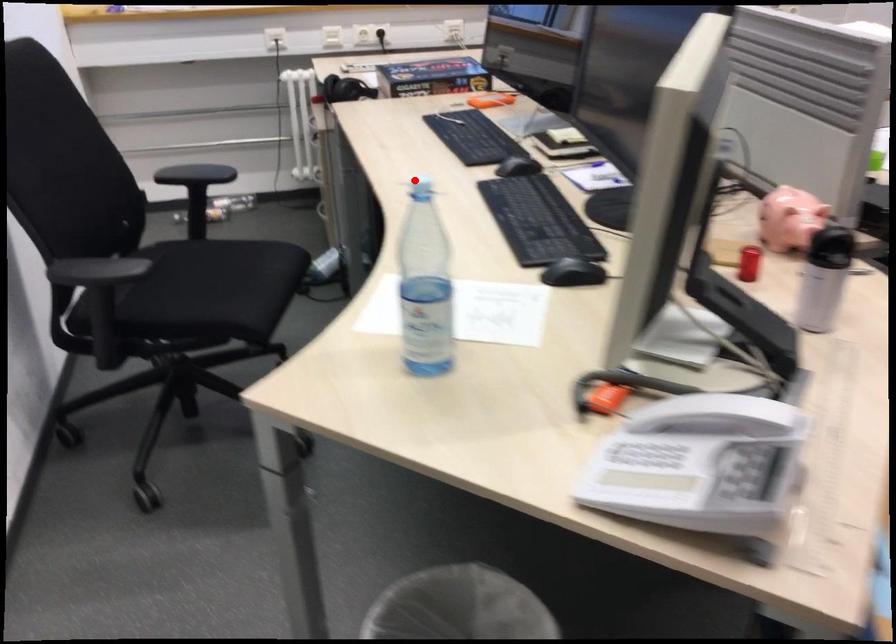
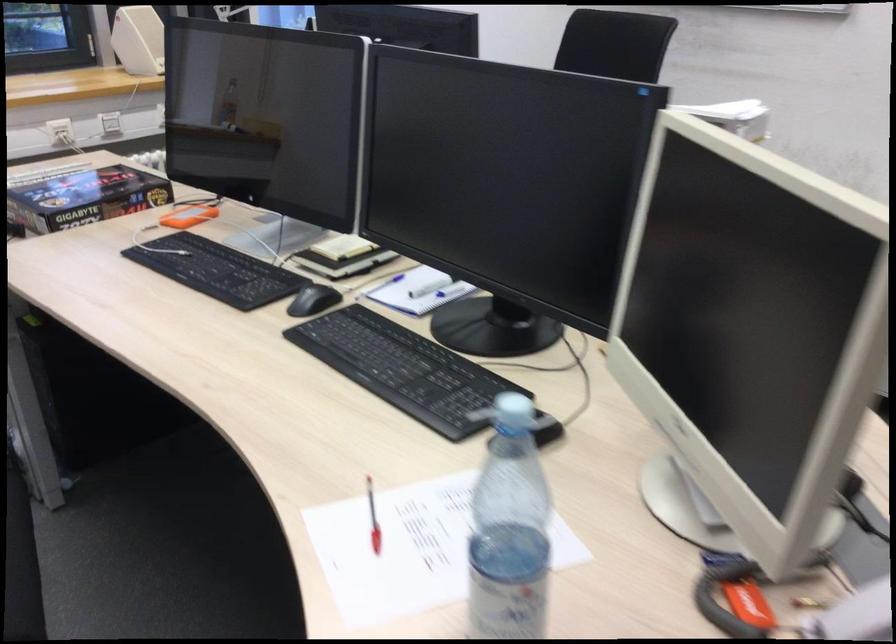
Find the pixel in the second image that matches the highlighted location in the first image.

(513, 410)